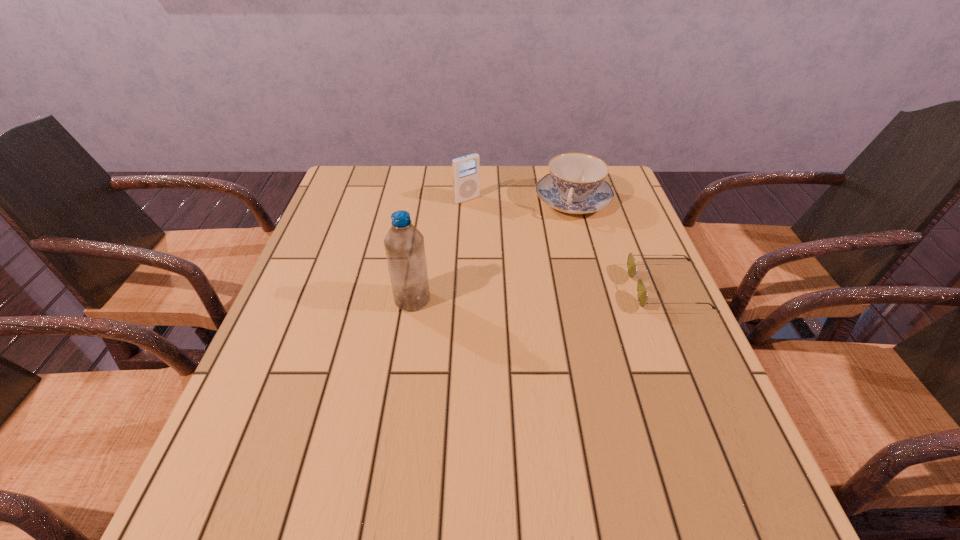
The width and height of the screenshot is (960, 540). Identify the location of object that is at the far right corner. (575, 185).

The height and width of the screenshot is (540, 960). What are the coordinates of `blank area at the far edge` in the screenshot? It's located at (489, 204).

In the image, there is a desktop. Where is `vacant space at the left edge`? vacant space at the left edge is located at coordinates (369, 247).

Locate an element on the screen. This screenshot has height=540, width=960. free spot at the right edge of the desktop is located at coordinates (622, 258).

You are a GUI agent. You are given a task and a screenshot of the screen. Output one action in this format:
    pyautogui.click(x=<x>, y=<y>)
    Task: Click on the vacant space at the far left corner of the desktop
    
    Given the screenshot: What is the action you would take?
    pyautogui.click(x=363, y=191)

In the image, there is a desktop. Where is `free space at the near left corner`? The width and height of the screenshot is (960, 540). free space at the near left corner is located at coordinates (250, 428).

In the image, there is a desktop. At what (x,y) coordinates should I click in order to perform the action: click on vacant region at the far right corner. Please return your answer as a coordinate pair (x, y). Image resolution: width=960 pixels, height=540 pixels. Looking at the image, I should click on (628, 191).

This screenshot has width=960, height=540. I want to click on empty space between the leftmost object and the sunglasses, so click(540, 294).

The image size is (960, 540). Identify the location of free spot between the shortest object and the water bottle. (540, 294).

The height and width of the screenshot is (540, 960). I want to click on unoccupied position between the iPod and the water bottle, so click(x=440, y=249).